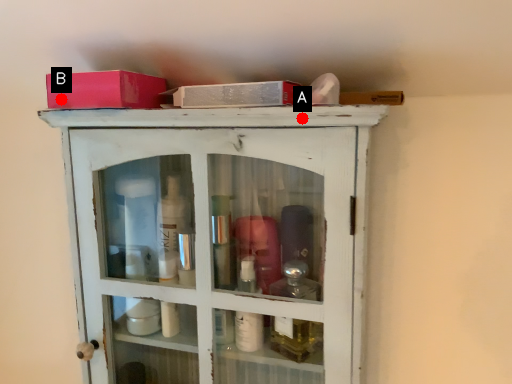
Question: Two points are circled on the image, labeled by A and B beside each circle. Among these points, which one is farthest from the camera?

Choices:
 (A) A is further
 (B) B is further

Answer: (B)